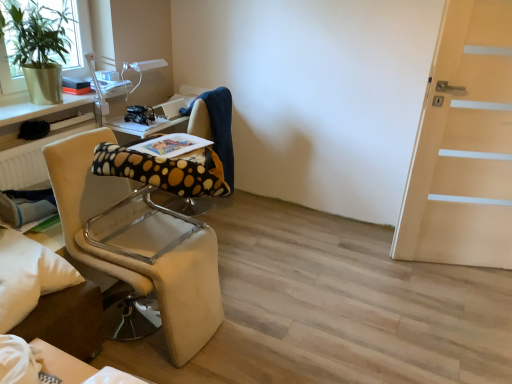
You are a GUI agent. You are given a task and a screenshot of the screen. Output one action in this format:
    pyautogui.click(x=<x>, y=<y>)
    Task: Click on the vacant area that lies between light wood door at right and beige fabric chair at left
    This screenshot has height=384, width=512.
    Given the screenshot: What is the action you would take?
    pyautogui.click(x=335, y=293)